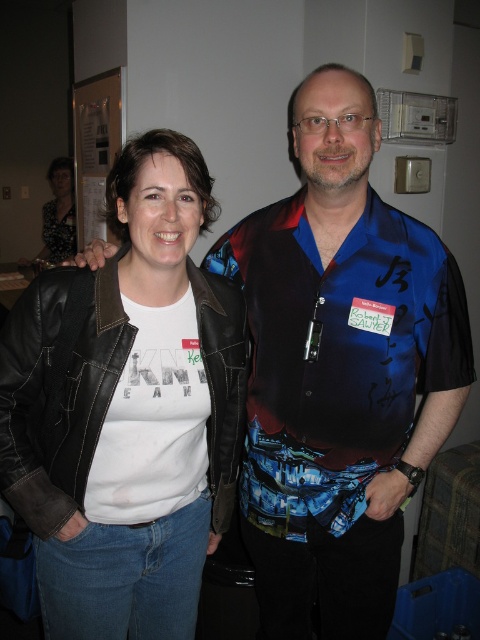
Based on the scene description, where is the leather jacket at left positioned in relation to the man on the right?

The leather jacket at left is positioned at point 0.642 on the horizontal axis and 0.267 on the vertical axis relative to the image frame.

You are standing in front of the two people in the image. Which of the two points, point (202, 369) or point (68, 193), is closer to you?

Point (202, 369) is closer to the viewer than point (68, 193).

You are at a social event and see the leather jacket at left and the patterned fabric blouse at upper left. Which clothing item is positioned lower on the person?

The leather jacket at left is positioned lower because it is located below the patterned fabric blouse at upper left.